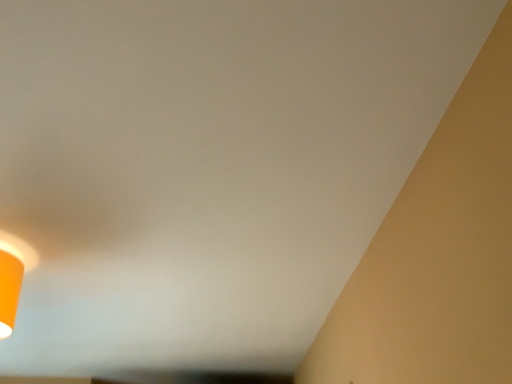
At what (x,y) coordinates should I click in order to perform the action: click on orange matte lamp at lower left. Please return your answer as a coordinate pair (x, y). Looking at the image, I should click on (12, 277).

What is the approximate width of orange matte lamp at lower left?

It is 7.99 inches.

What do you see at coordinates (12, 277) in the screenshot? I see `orange matte lamp at lower left` at bounding box center [12, 277].

Image resolution: width=512 pixels, height=384 pixels. In order to click on orange matte lamp at lower left in this screenshot , I will do `click(12, 277)`.